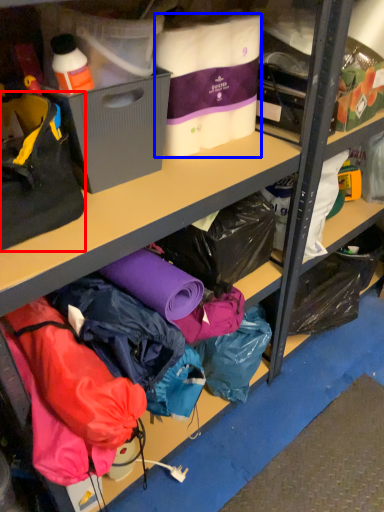
Question: Among these objects, which one is farthest to the camera, handbag (highlighted by a red box) or clothing (highlighted by a blue box)?

Choices:
 (A) handbag
 (B) clothing

Answer: (B)